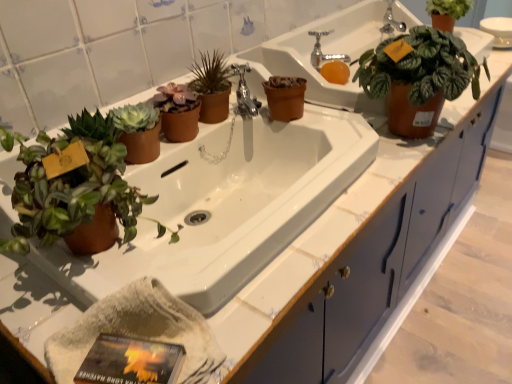
Question: Is matte brown pot at center, which is counted as the 2th houseplant, starting from the left, facing away from green matte plant at upper right, the second houseplant positioned from the front?

Choices:
 (A) yes
 (B) no

Answer: (B)

Question: Does matte brown pot at center, placed as the third houseplant when sorted from right to left, turn towards green matte plant at upper right, which is the third houseplant from back to front?

Choices:
 (A) yes
 (B) no

Answer: (B)

Question: Does matte brown pot at center, the second houseplant from the back, have a greater height compared to green matte plant at upper right, the 2th houseplant in the right-to-left sequence?

Choices:
 (A) yes
 (B) no

Answer: (B)

Question: Can you confirm if matte brown pot at center, which is counted as the 2th houseplant, starting from the left, is positioned to the right of green matte plant at upper right, which is the third houseplant from back to front?

Choices:
 (A) yes
 (B) no

Answer: (B)

Question: Is matte brown pot at center, which is counted as the 3th houseplant, starting from the front, not inside green matte plant at upper right, the second houseplant positioned from the front?

Choices:
 (A) no
 (B) yes

Answer: (B)

Question: Choose the correct answer: Is silver metallic faucet at upper center, which appears as the 2th faucet when viewed from the right, inside matte brown pot at left, which is the fourth houseplant from right to left, or outside it?

Choices:
 (A) outside
 (B) inside

Answer: (A)

Question: From a real-world perspective, is silver metallic faucet at upper center, which ranks as the 1th faucet in left-to-right order, physically located above or below matte brown pot at left, placed as the 1th houseplant when sorted from left to right?

Choices:
 (A) below
 (B) above

Answer: (A)

Question: Is silver metallic faucet at upper center, which ranks as the 1th faucet in left-to-right order, bigger or smaller than matte brown pot at left, marked as the 1th houseplant in a front-to-back arrangement?

Choices:
 (A) big
 (B) small

Answer: (B)

Question: Considering the relative positions of silver metallic faucet at upper center, marked as the first faucet in a bottom-to-top arrangement, and matte brown pot at left, marked as the 1th houseplant in a front-to-back arrangement, in the image provided, is silver metallic faucet at upper center, marked as the first faucet in a bottom-to-top arrangement, to the left or to the right of matte brown pot at left, marked as the 1th houseplant in a front-to-back arrangement,?

Choices:
 (A) left
 (B) right

Answer: (B)

Question: From the image's perspective, is matte brown pot at upper left above or below silver metallic faucet at upper center, marked as the first faucet in a bottom-to-top arrangement?

Choices:
 (A) above
 (B) below

Answer: (B)

Question: Do you think matte brown pot at upper left is within silver metallic faucet at upper center, the 2th faucet from the back, or outside of it?

Choices:
 (A) outside
 (B) inside

Answer: (A)

Question: Considering the positions of matte brown pot at upper left and silver metallic faucet at upper center, which ranks as the 1th faucet in left-to-right order, in the image, is matte brown pot at upper left taller or shorter than silver metallic faucet at upper center, which ranks as the 1th faucet in left-to-right order,?

Choices:
 (A) tall
 (B) short

Answer: (A)

Question: From a real-world perspective, is matte brown pot at upper left above or below silver metallic faucet at upper center, marked as the first faucet in a bottom-to-top arrangement?

Choices:
 (A) above
 (B) below

Answer: (B)

Question: In terms of size, does matte brown pot at center, which is counted as the 3th houseplant, starting from the front, appear bigger or smaller than green matte plant at upper right, the second houseplant positioned from the front?

Choices:
 (A) small
 (B) big

Answer: (A)

Question: Is matte brown pot at center, which is counted as the 2th houseplant, starting from the left, in front of or behind green matte plant at upper right, which is the third houseplant from back to front, in the image?

Choices:
 (A) front
 (B) behind

Answer: (B)